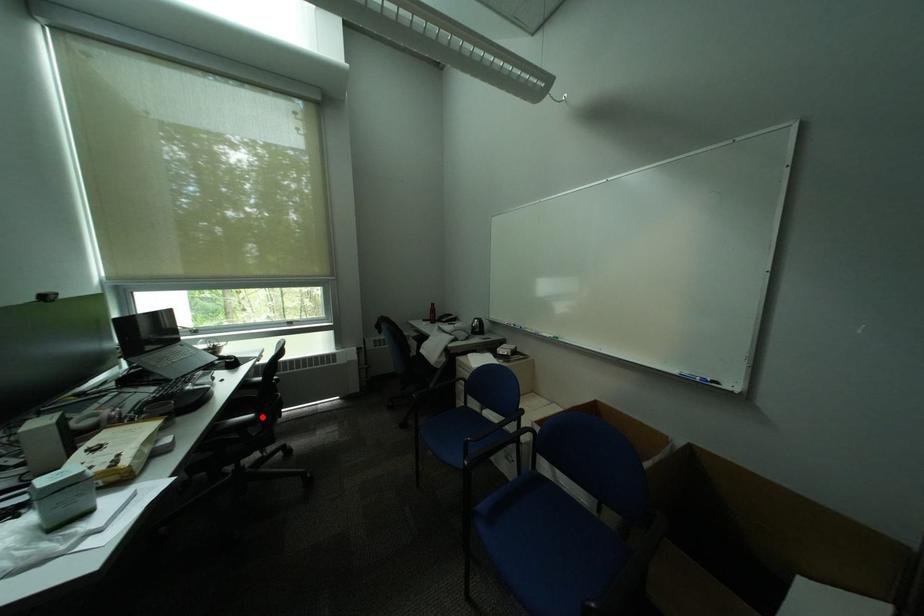
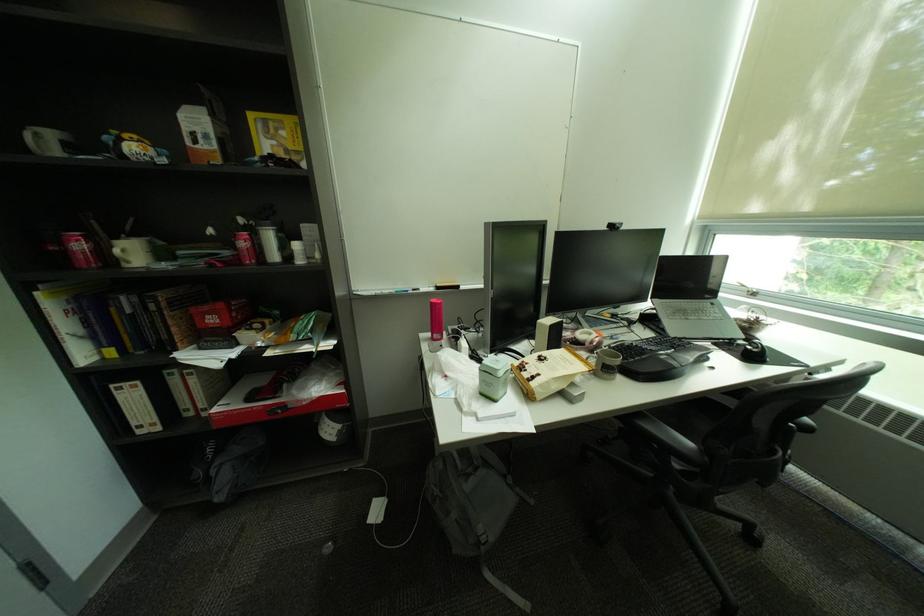
Find the pixel in the second image that matches the highlighted location in the first image.

(700, 445)